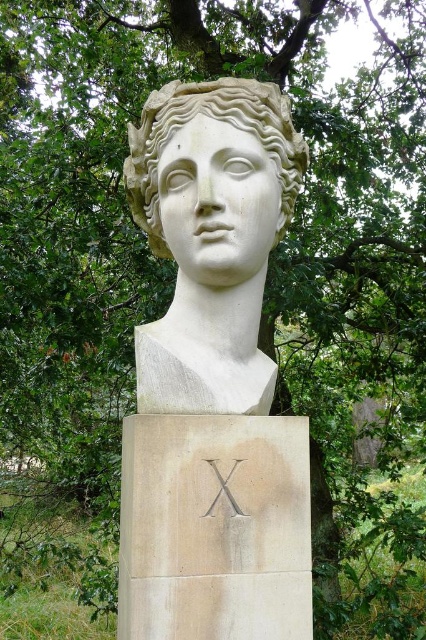
You are an art conservator examining the white marble bust at center and the white marble head at center. Which object has a greater width?

The white marble bust at center has a greater width than the white marble head at center.

You are an art conservator examining the sculpture. You notice two parts of the sculpture labeled as the white marble bust at center and the white marble head at center. Which part is positioned closer to you?

The white marble bust at center is closer to the viewer than the white marble head at center.